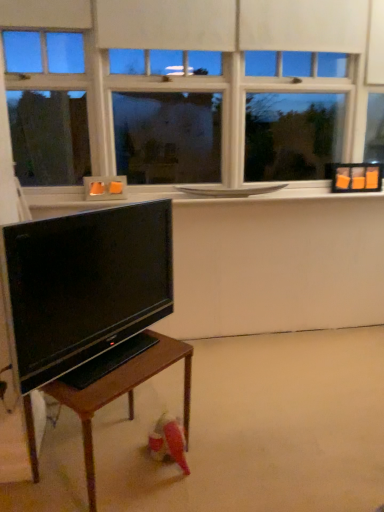
Question: Is white matte window at upper center in front of matte black tv at lower left?

Choices:
 (A) no
 (B) yes

Answer: (A)

Question: Does white matte window at upper center have a lesser height compared to matte black tv at lower left?

Choices:
 (A) yes
 (B) no

Answer: (B)

Question: Is white matte window at upper center not near matte black tv at lower left?

Choices:
 (A) yes
 (B) no

Answer: (A)

Question: From a real-world perspective, is white matte window at upper center under matte black tv at lower left?

Choices:
 (A) no
 (B) yes

Answer: (A)

Question: Considering the relative sizes of white matte window at upper center and matte black tv at lower left in the image provided, is white matte window at upper center bigger than matte black tv at lower left?

Choices:
 (A) no
 (B) yes

Answer: (B)

Question: Is matte black tv at lower left in front of or behind wooden table at lower left in the image?

Choices:
 (A) front
 (B) behind

Answer: (A)

Question: From the image's perspective, is matte black tv at lower left positioned above or below wooden table at lower left?

Choices:
 (A) below
 (B) above

Answer: (B)

Question: Choose the correct answer: Is matte black tv at lower left inside wooden table at lower left or outside it?

Choices:
 (A) outside
 (B) inside

Answer: (A)

Question: Is matte black tv at lower left taller or shorter than wooden table at lower left?

Choices:
 (A) tall
 (B) short

Answer: (A)

Question: Is white matte window at upper center bigger or smaller than white glossy window sill at upper center?

Choices:
 (A) small
 (B) big

Answer: (B)

Question: From the image's perspective, relative to white glossy window sill at upper center, is white matte window at upper center above or below?

Choices:
 (A) above
 (B) below

Answer: (A)

Question: Considering the positions of point (18, 100) and point (54, 205), is point (18, 100) closer or farther from the camera than point (54, 205)?

Choices:
 (A) farther
 (B) closer

Answer: (A)

Question: From their relative heights in the image, would you say white matte window at upper center is taller or shorter than white glossy window sill at upper center?

Choices:
 (A) short
 (B) tall

Answer: (B)

Question: From the image's perspective, is white glossy window sill at upper center located above or below wooden table at lower left?

Choices:
 (A) above
 (B) below

Answer: (A)

Question: Considering the positions of white glossy window sill at upper center and wooden table at lower left in the image, is white glossy window sill at upper center wider or thinner than wooden table at lower left?

Choices:
 (A) wide
 (B) thin

Answer: (B)